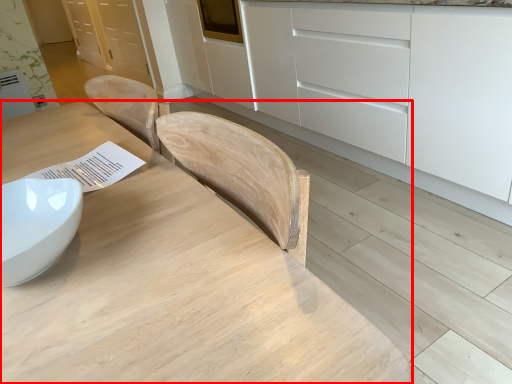
Question: Considering the relative positions of table (annotated by the red box) and cabinetry in the image provided, where is table (annotated by the red box) located with respect to the staircase?

Choices:
 (A) right
 (B) left

Answer: (B)